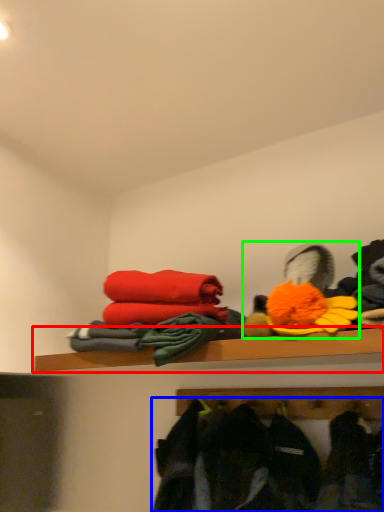
Question: Considering the real-world distances, which object is farthest from shelf (highlighted by a red box)? clothing (highlighted by a blue box) or toy (highlighted by a green box)?

Choices:
 (A) clothing
 (B) toy

Answer: (A)